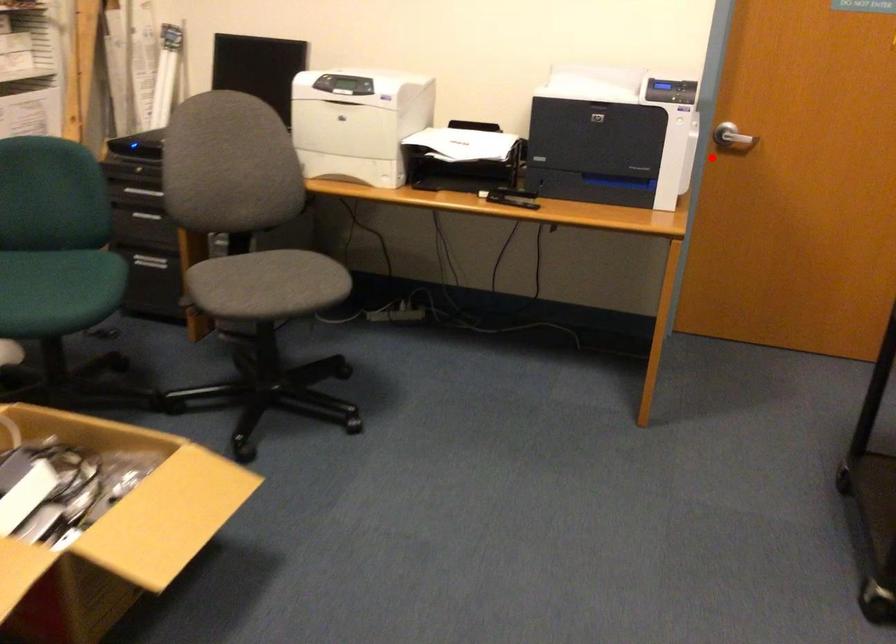
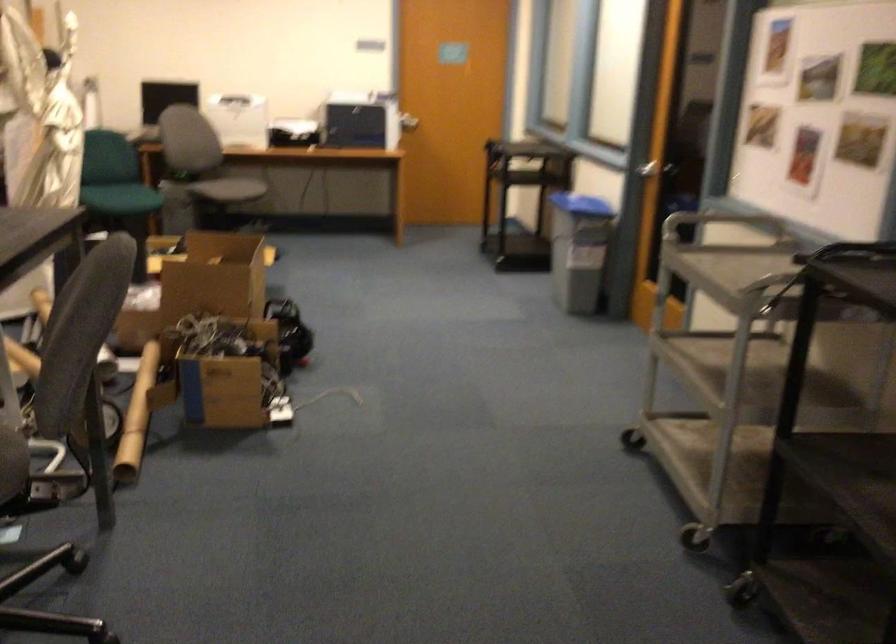
Question: I am providing you with two images of the same scene from different viewpoints. Given a red point in image1, look at the same physical point in image2. Is it:

Choices:
 (A) Closer to the viewpoint
 (B) Farther from the viewpoint

Answer: (B)